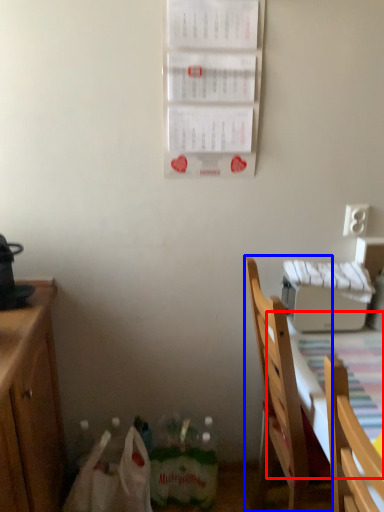
Question: Which object is closer to the camera taking this photo, tablecloth (highlighted by a red box) or chair (highlighted by a blue box)?

Choices:
 (A) tablecloth
 (B) chair

Answer: (A)